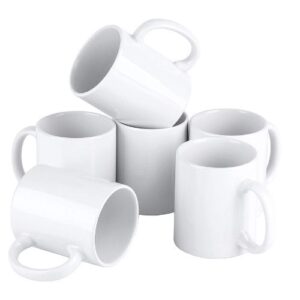
What are the coordinates of `inside of mug` in the screenshot? It's located at (121, 217), (82, 123), (213, 151), (223, 126), (180, 120), (98, 64).